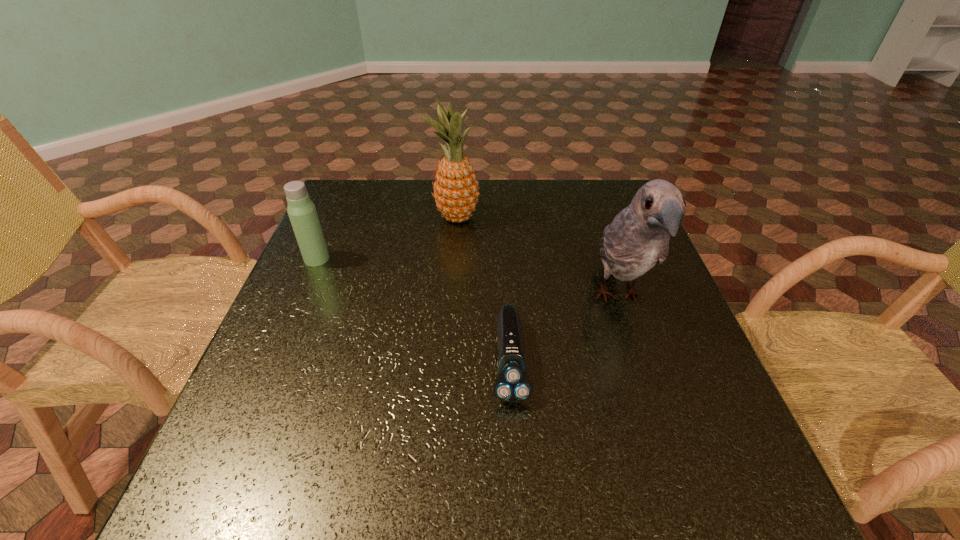
Locate an element on the screen. Image resolution: width=960 pixels, height=540 pixels. vacant space located on the head of the third object from left to right is located at coordinates (515, 444).

What are the coordinates of `object at the far edge` in the screenshot? It's located at (456, 194).

What are the coordinates of `object at the left edge` in the screenshot? It's located at (302, 213).

Where is `object positioned at the right edge`? Image resolution: width=960 pixels, height=540 pixels. object positioned at the right edge is located at coordinates (638, 238).

The width and height of the screenshot is (960, 540). What are the coordinates of `blank space at the far edge` in the screenshot? It's located at (564, 200).

Find the location of `free region at the left edge`. free region at the left edge is located at coordinates (314, 377).

In order to click on free space at the right edge of the desktop in this screenshot , I will do `click(703, 385)`.

Find the location of a particular element. The height and width of the screenshot is (540, 960). free space at the far left corner of the desktop is located at coordinates (381, 200).

Image resolution: width=960 pixels, height=540 pixels. In order to click on blank space at the far right corner of the desktop in this screenshot , I will do `click(591, 205)`.

Locate an element on the screen. vacant area between the thermos bottle and the rightmost object is located at coordinates (468, 278).